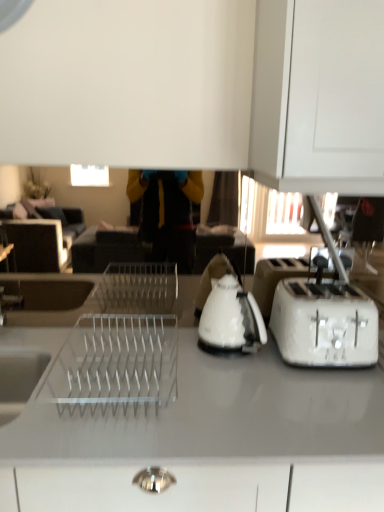
Measure the distance between white glossy kettle at center and camera.

white glossy kettle at center is 1.29 meters from camera.

Identify the location of white glossy countertop at center. The image size is (384, 512). (210, 441).

Which of these two, white glossy countertop at center or white plastic toaster at right, stands shorter?

white plastic toaster at right is shorter.

Consider the image. Relative to white plastic toaster at right, is white glossy countertop at center in front or behind?

white glossy countertop at center is in front of white plastic toaster at right.

Considering the sizes of objects white glossy countertop at center and white plastic toaster at right in the image provided, who is wider, white glossy countertop at center or white plastic toaster at right?

Wider between the two is white glossy countertop at center.

Is point (191, 456) in front of point (332, 306)?

Yes, it is.

Which object is thinner, white glossy countertop at center or white glossy kettle at center?

white glossy kettle at center.

From the image's perspective, would you say white glossy countertop at center is positioned over white glossy kettle at center?

No, from the image's perspective, white glossy countertop at center is not above white glossy kettle at center.

Which is behind, white glossy countertop at center or white glossy kettle at center?

white glossy kettle at center is more distant.

Is white glossy countertop at center not near white glossy kettle at center?

No, white glossy countertop at center is in close proximity to white glossy kettle at center.

How distant is white glossy kettle at center from white glossy countertop at center?

10.75 inches.

Find the location of a particular element. countertop that appears on the left of white glossy kettle at center is located at coordinates (210, 441).

Would you say white glossy kettle at center is a long distance from white glossy countertop at center?

No, white glossy kettle at center is not far from white glossy countertop at center.

From a real-world perspective, is white glossy kettle at center physically located above or below white glossy countertop at center?

In terms of real-world spatial position, white glossy kettle at center is above white glossy countertop at center.

In the scene shown: Is white plastic toaster at right to the left of white glossy kettle at center from the viewer's perspective?

Incorrect, white plastic toaster at right is not on the left side of white glossy kettle at center.

Based on the photo, is white plastic toaster at right spatially inside white glossy kettle at center, or outside of it?

white plastic toaster at right is spatially situated outside white glossy kettle at center.

Is white plastic toaster at right in contact with white glossy kettle at center?

No.

Who is shorter, white plastic toaster at right or white glossy kettle at center?

white plastic toaster at right is shorter.

Considering the relative sizes of white glossy kettle at center and white plastic toaster at right in the image provided, is white glossy kettle at center shorter than white plastic toaster at right?

No, white glossy kettle at center is not shorter than white plastic toaster at right.

Is white glossy kettle at center closer to the viewer compared to white plastic toaster at right?

No, the depth of white glossy kettle at center is greater than that of white plastic toaster at right.

Is white plastic toaster at right at the back of white glossy kettle at center?

No, white plastic toaster at right is not at the back of white glossy kettle at center.

From the image's perspective, between white glossy kettle at center and white plastic toaster at right, which one is located above?

white glossy kettle at center.

Does white plastic toaster at right touch white glossy countertop at center?

white plastic toaster at right and white glossy countertop at center are not in contact.

Does white plastic toaster at right appear on the left side of white glossy countertop at center?

No.

Is white plastic toaster at right facing towards white glossy countertop at center?

No, white plastic toaster at right is not oriented towards white glossy countertop at center.

From the image's perspective, would you say white plastic toaster at right is shown under white glossy countertop at center?

No.

At what (x,y) coordinates should I click in order to perform the action: click on countertop on the left of white plastic toaster at right. Please return your answer as a coordinate pair (x, y). This screenshot has width=384, height=512. Looking at the image, I should click on (210, 441).

Find the location of a particular element. The width and height of the screenshot is (384, 512). kettle behind the white glossy countertop at center is located at coordinates (231, 317).

Which object lies further to the anchor point white glossy countertop at center, white plastic toaster at right or white glossy kettle at center?

white glossy kettle at center.

Based on their spatial positions, is white glossy countertop at center or white glossy kettle at center closer to white plastic toaster at right?

white glossy kettle at center lies closer to white plastic toaster at right than the other object.

Which object lies nearer to the anchor point white glossy kettle at center, white plastic toaster at right or white glossy countertop at center?

white plastic toaster at right lies closer to white glossy kettle at center than the other object.

Which object lies nearer to the anchor point white plastic toaster at right, white glossy kettle at center or white glossy countertop at center?

white glossy kettle at center is positioned closer to the anchor white plastic toaster at right.

Consider the image. Which object lies nearer to the anchor point white glossy kettle at center, white glossy countertop at center or white plastic toaster at right?

The object closer to white glossy kettle at center is white plastic toaster at right.

From the image, which object appears to be nearer to white glossy countertop at center, white glossy kettle at center or white plastic toaster at right?

white plastic toaster at right lies closer to white glossy countertop at center than the other object.

This screenshot has width=384, height=512. In order to click on toaster between white glossy kettle at center and white glossy countertop at center vertically in this screenshot , I will do `click(324, 324)`.